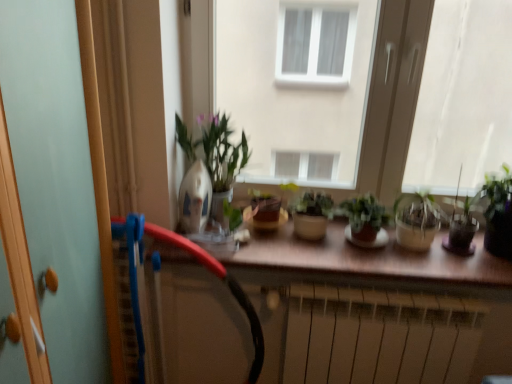
Question: In terms of size, does black rubber garden hose at center appear bigger or smaller than translucent glass pot at right, the 2th houseplant from the right?

Choices:
 (A) small
 (B) big

Answer: (B)

Question: Relative to translucent glass pot at right, the third houseplant when ordered from left to right, is black rubber garden hose at center in front or behind?

Choices:
 (A) front
 (B) behind

Answer: (A)

Question: Considering the real-world distances, which object is closest to the light blue glass screen door at left?

Choices:
 (A) translucent glass vase at right, acting as the first houseplant starting from the right
 (B) brown matte counter top at center
 (C) black rubber garden hose at center
 (D) transparent glass window at right, the second window positioned from the left
 (E) green matte plant at center, which is counted as the third houseplant, starting from the right

Answer: (C)

Question: Based on their relative distances, which object is farther from the translucent glass pot at right, the 2th houseplant from the right?

Choices:
 (A) translucent glass vase at right, acting as the first houseplant starting from the right
 (B) transparent glass window at center, the second window positioned from the right
 (C) green matte plant at center, which is counted as the third houseplant, starting from the right
 (D) black rubber garden hose at center
 (E) brown matte counter top at center

Answer: (D)